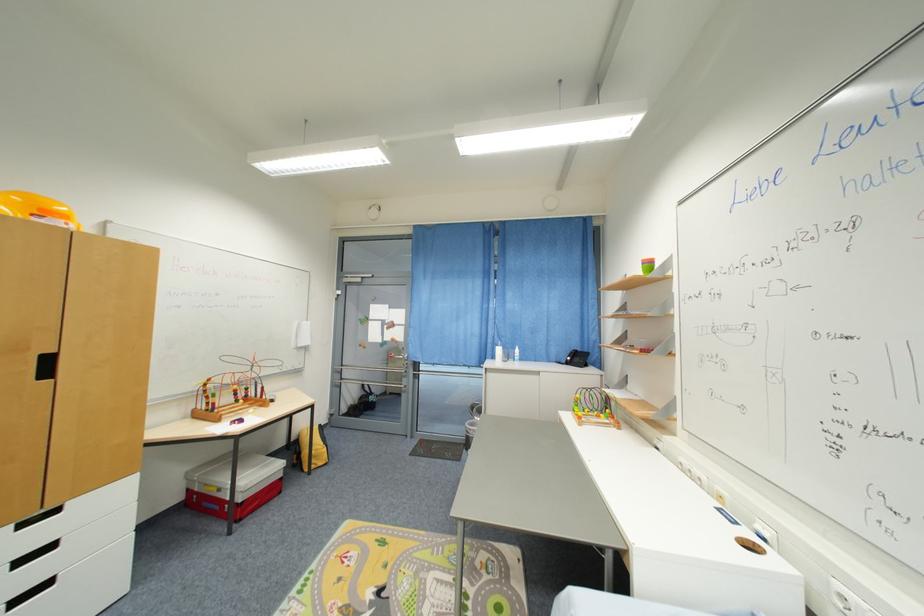
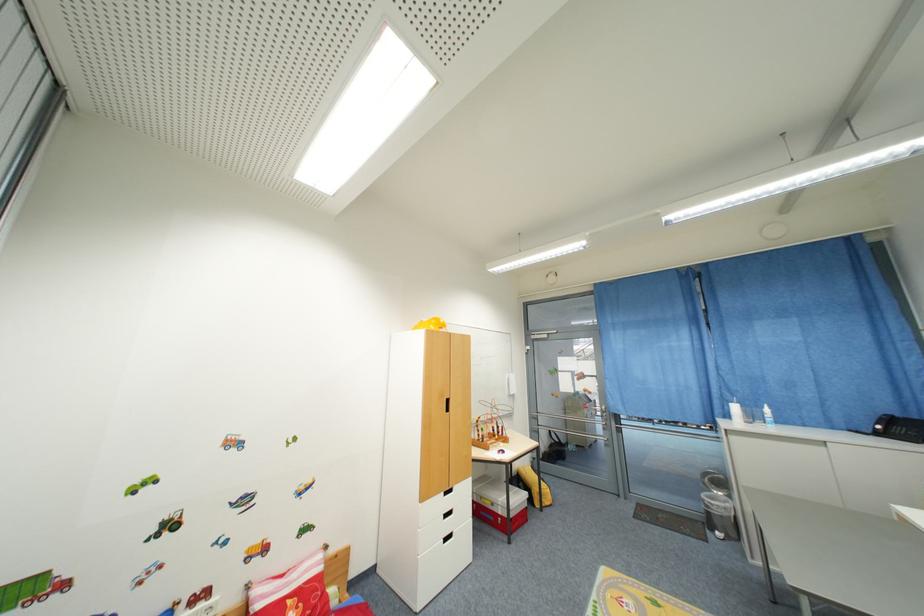
The point at (367,400) is marked in the first image. Where is the corresponding point in the second image?

(555, 448)